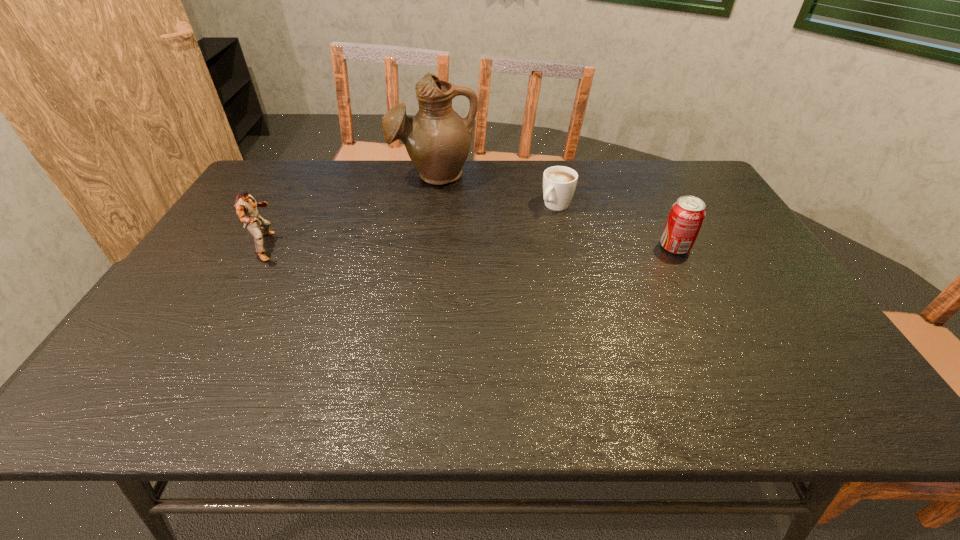
You are a GUI agent. You are given a task and a screenshot of the screen. Output one action in this format:
    pyautogui.click(x=<x>, y=<y>)
    Task: Click on the vacant space that's between the third object from right to left and the soda
    This screenshot has width=960, height=540.
    Given the screenshot: What is the action you would take?
    pyautogui.click(x=555, y=211)

This screenshot has height=540, width=960. Find the location of `free space that is in between the puncher and the second shortest object`. free space that is in between the puncher and the second shortest object is located at coordinates (470, 247).

This screenshot has width=960, height=540. Identify the location of free space between the second tallest object and the cappuccino. (412, 226).

The image size is (960, 540). I want to click on unoccupied position between the cappuccino and the rightmost object, so click(x=615, y=226).

This screenshot has height=540, width=960. What are the coordinates of `unoccupied position between the shortest object and the second shortest object` in the screenshot? It's located at (615, 226).

Select which object appears as the second closest to the second object from left to right. Please provide its 2D coordinates. Your answer should be formatted as a tuple, i.e. [(x, y)], where the tuple contains the x and y coordinates of a point satisfying the conditions above.

[(246, 207)]

This screenshot has width=960, height=540. In order to click on object that stands as the closest to the leftmost object in this screenshot , I will do `click(438, 141)`.